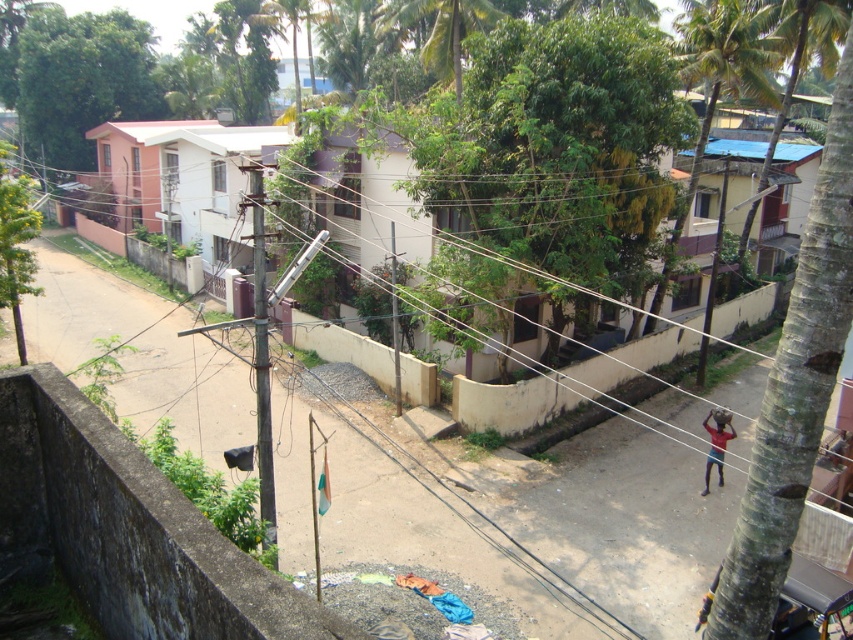
From the picture: You are a painter standing on the balcony overlooking the street scene. You want to paint both the green rough bark tree at right and the green leafy palm tree at upper right. Which tree should you focus on first if you want to capture the wider tree in your painting?

The green rough bark tree at right should be focused on first because its width surpasses that of the green leafy palm tree at upper right, making it the wider tree to capture.

You are standing at the viewpoint of the image and want to take a photo of the green rough bark tree at right. If your camera can focus on objects up to 7 meters away, will it be able to capture a clear image of the tree?

The green rough bark tree at right is 6.99 meters away from the camera, which is within the camera focus range of up to 7 meters. Therefore, the camera can capture a clear image of the tree.